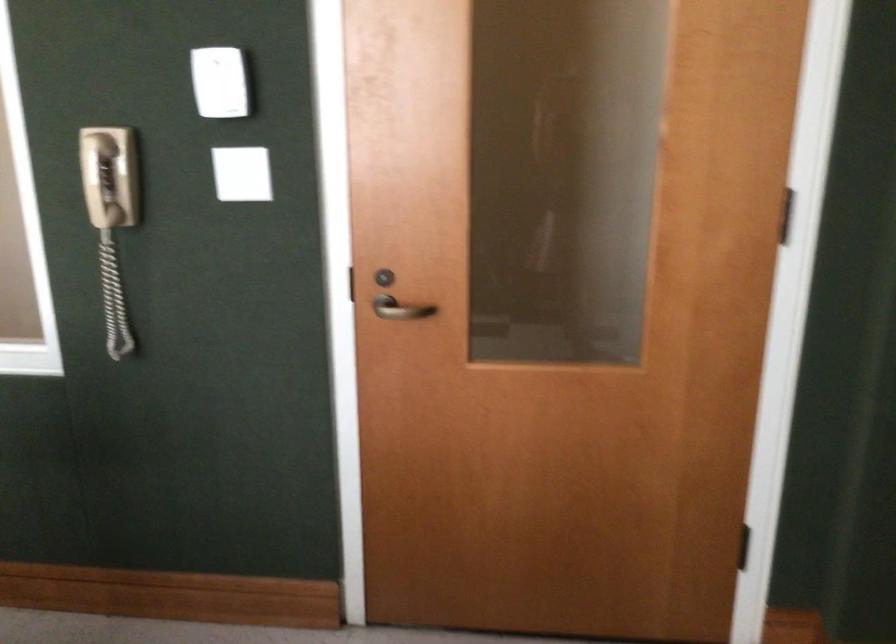
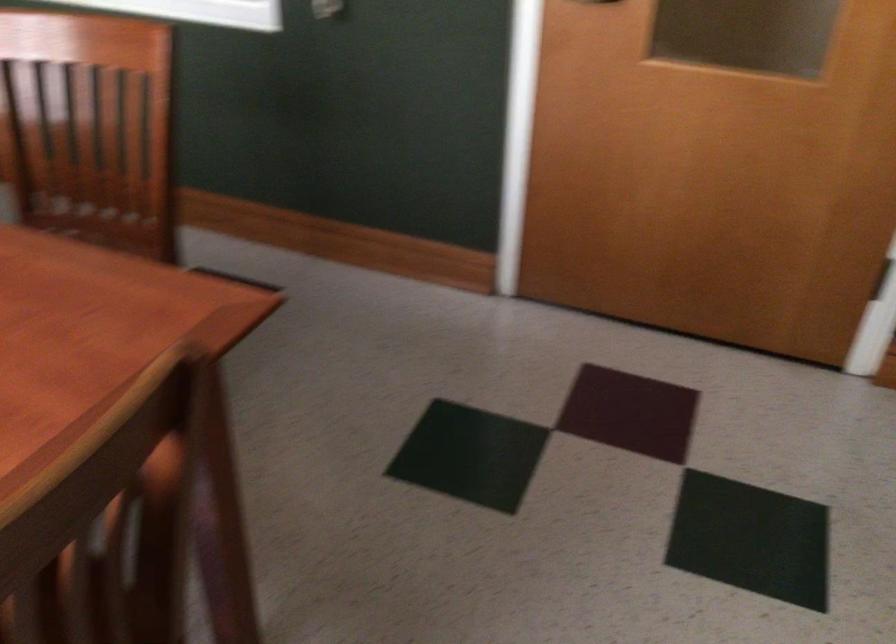
Question: The first image is from the beginning of the video and the second image is from the end. How did the camera likely rotate when shooting the video?

Choices:
 (A) Left
 (B) Right
 (C) Up
 (D) Down

Answer: (D)